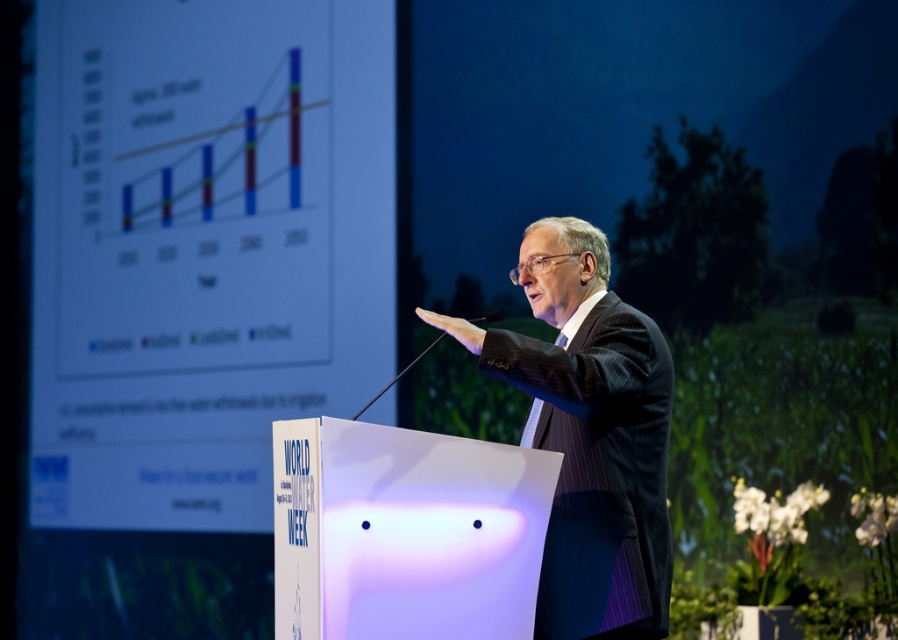
Is matte white screen at upper left above dark suit at center?

Correct, matte white screen at upper left is located above dark suit at center.

Looking at this image, does matte white screen at upper left have a smaller size compared to dark suit at center?

Incorrect, matte white screen at upper left is not smaller in size than dark suit at center.

Locate an element on the screen. Image resolution: width=898 pixels, height=640 pixels. matte white screen at upper left is located at coordinates (201, 248).